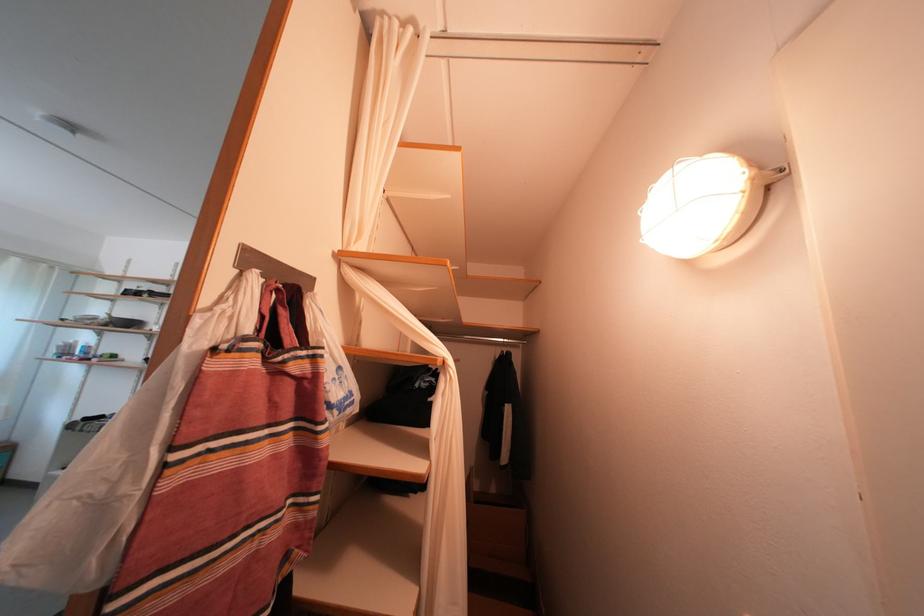
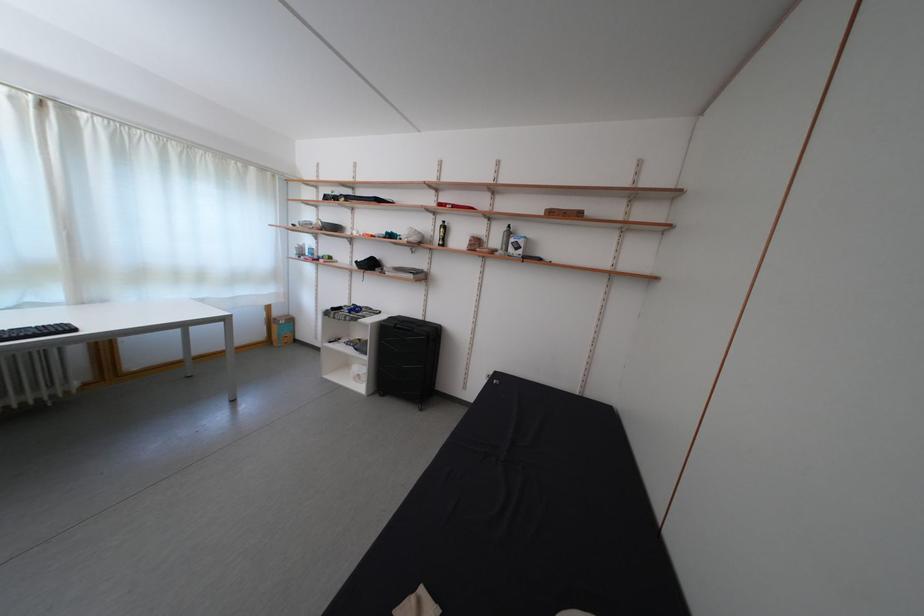
The first image is from the beginning of the video and the second image is from the end. How did the camera likely rotate when shooting the video?

The camera rotated toward left-down.